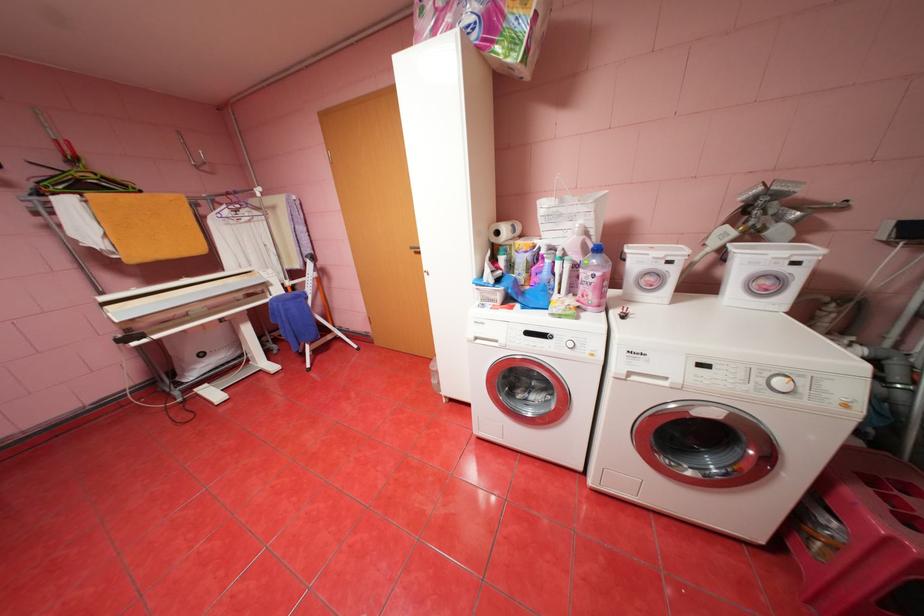
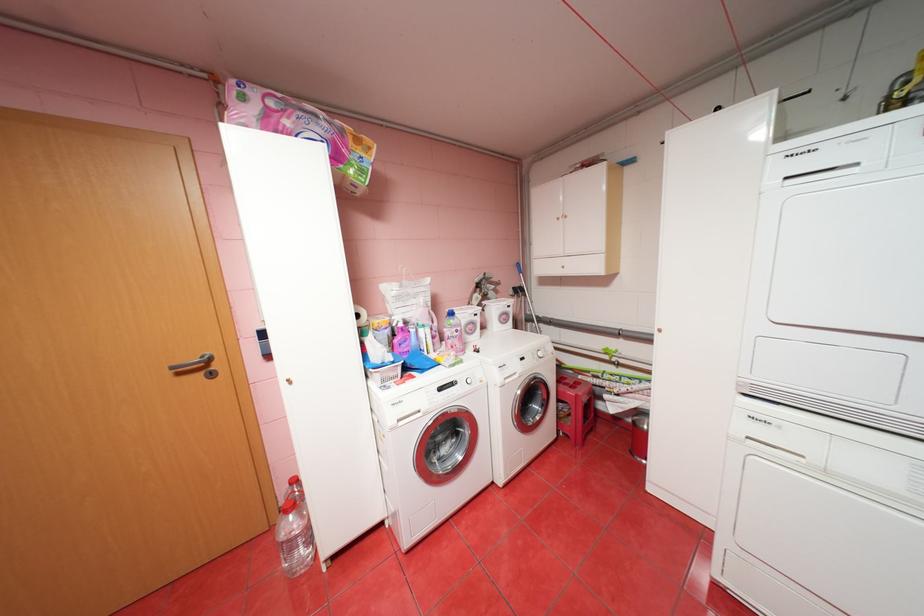
Question: How did the camera likely rotate?

Choices:
 (A) Left
 (B) Right
 (C) Up
 (D) Down

Answer: (B)